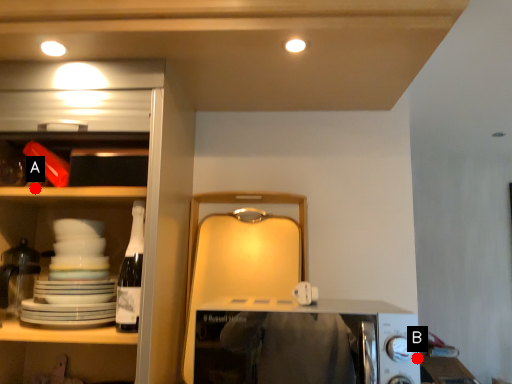
Question: Two points are circled on the image, labeled by A and B beside each circle. Which point appears farthest from the camera in this image?

Choices:
 (A) A is further
 (B) B is further

Answer: (A)